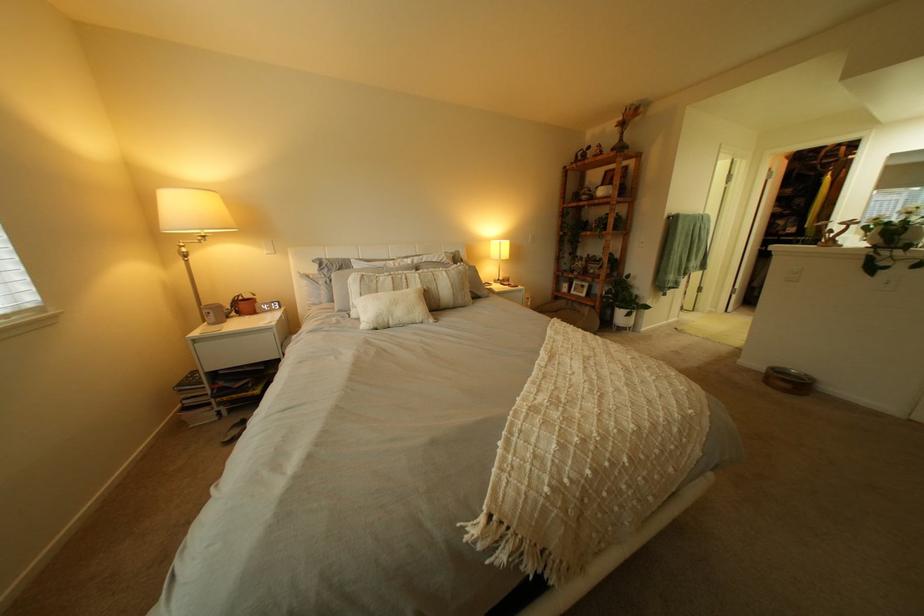
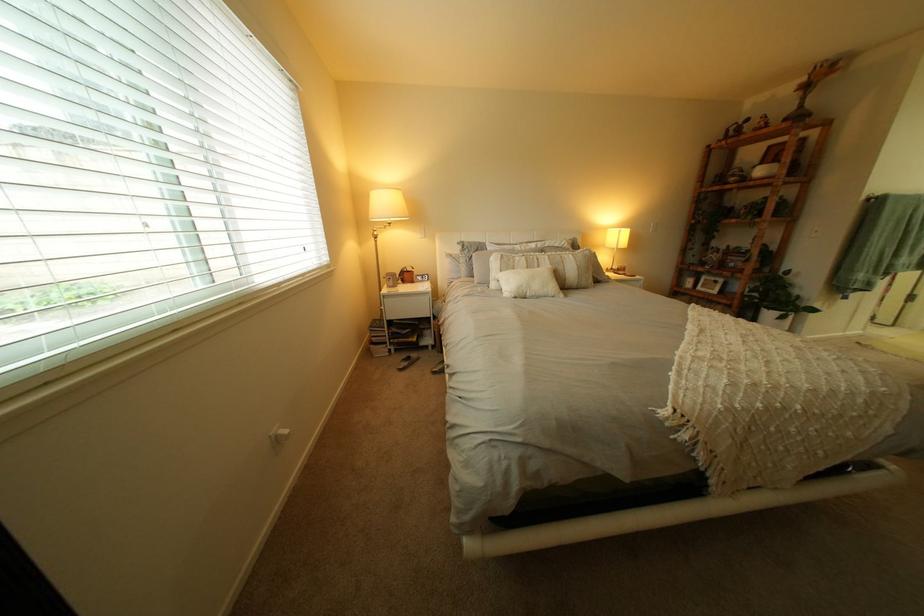
Question: How did the camera likely rotate?

Choices:
 (A) Left
 (B) Right
 (C) Up
 (D) Down

Answer: (A)